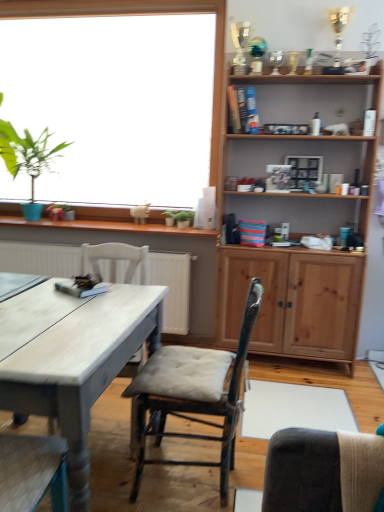
Question: Considering their positions, is white painted wood desk at left located in front of or behind green leafy plant at upper left?

Choices:
 (A) behind
 (B) front

Answer: (B)

Question: Is white painted wood desk at left inside or outside of green leafy plant at upper left?

Choices:
 (A) inside
 (B) outside

Answer: (B)

Question: Considering the real-world distances, which object is closest to the green leafy plant at upper left?

Choices:
 (A) white wood chair at left, which is the first chair in left-to-right order
 (B) wooden cushioned chair at center, positioned as the 2th chair in left-to-right order
 (C) wooden cabinet at upper right
 (D) white painted wood desk at left

Answer: (A)

Question: Considering the real-world distances, which object is farthest from the wooden cabinet at upper right?

Choices:
 (A) white painted wood desk at left
 (B) white wood chair at left, placed as the second chair when sorted from right to left
 (C) wooden cushioned chair at center, positioned as the 2th chair in left-to-right order
 (D) green leafy plant at upper left

Answer: (D)